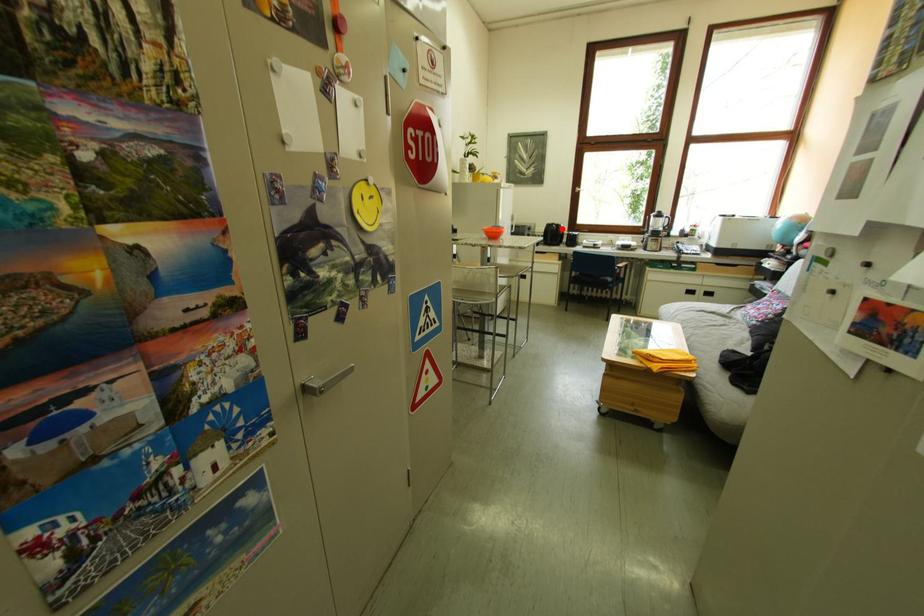
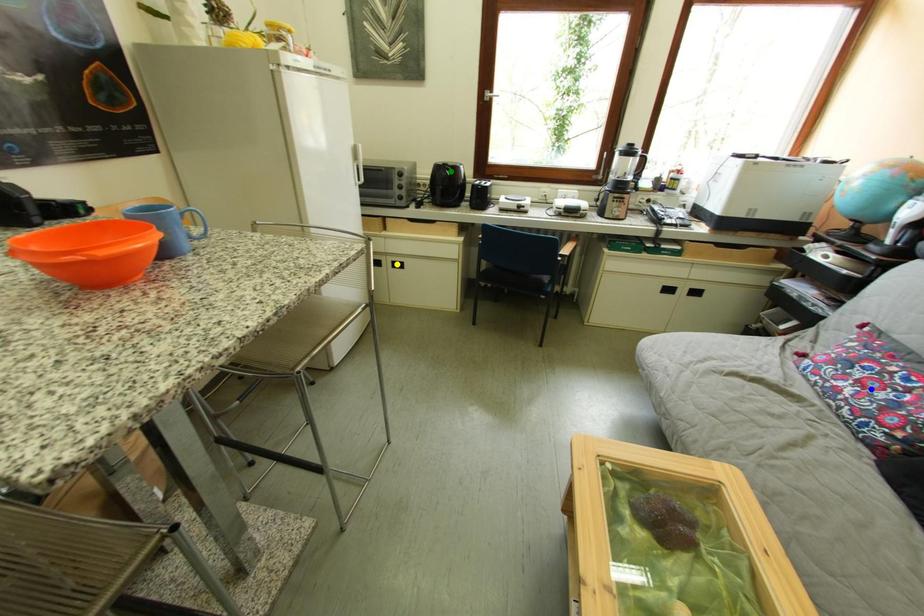
Question: I am providing you with two images of the same scene from different viewpoints. A red point is marked on the first image. You are given multiple points on the second image. Which spot in image 2 lines up with the point in image 1?

Choices:
 (A) blue point
 (B) yellow point
 (C) green point

Answer: (C)